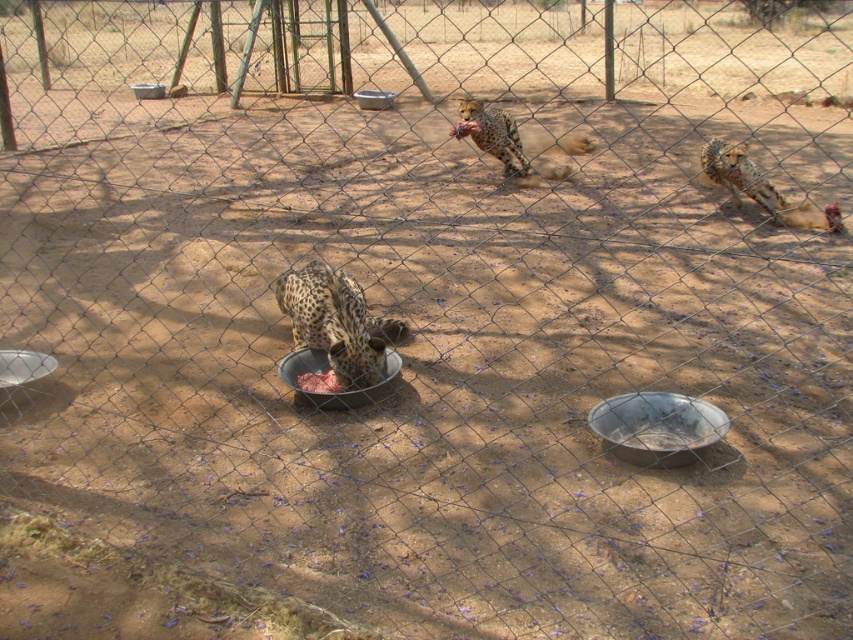
Does spotted fur cheetah at upper center have a greater width compared to metallic silver bowl at center?

Yes.

Is spotted fur cheetah at upper center to the right of metallic silver bowl at center from the viewer's perspective?

Correct, you'll find spotted fur cheetah at upper center to the right of metallic silver bowl at center.

The image size is (853, 640). Identify the location of spotted fur cheetah at upper center. (491, 132).

Between point (676, 403) and point (321, 387), which one is positioned in front?

Point (676, 403) is more forward.

Locate an element on the screen. The width and height of the screenshot is (853, 640). metallic silver bowl at lower right is located at coordinates (657, 428).

Between point (373, 328) and point (387, 104), which one is positioned behind?

Point (387, 104)

Can you confirm if spotted fur cheetah at lower center is smaller than metallic silver bowl at center?

Yes, spotted fur cheetah at lower center is smaller than metallic silver bowl at center.

Is point (370, 356) positioned behind point (381, 92)?

That is False.

Find the location of `spotted fur cheetah at lower center`. spotted fur cheetah at lower center is located at coordinates point(335,321).